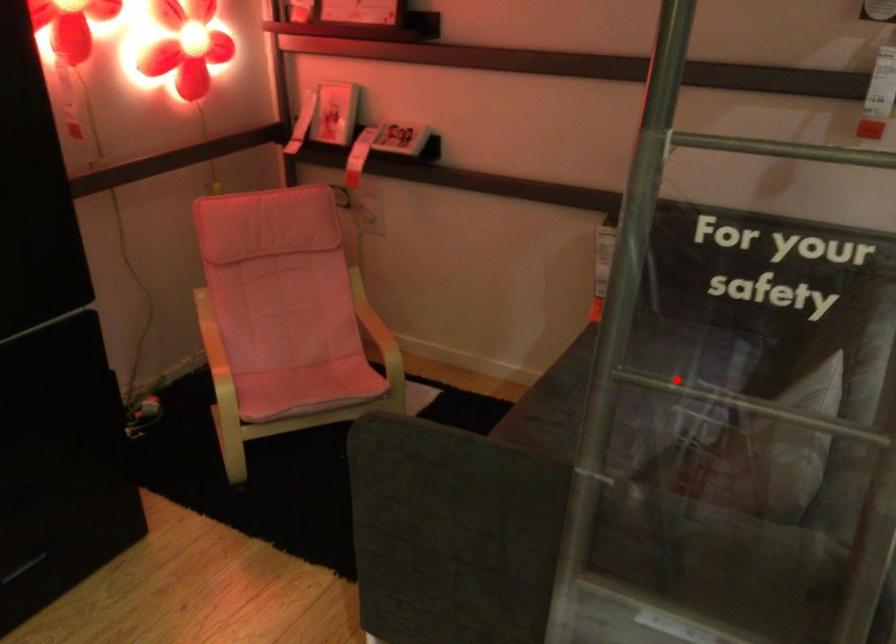
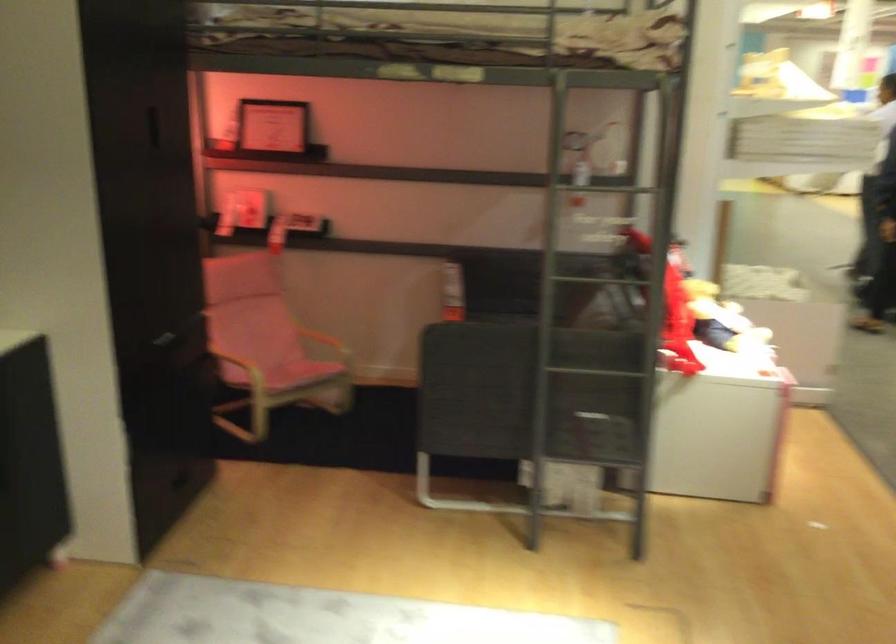
The point at the highlighted location is marked in the first image. Where is the corresponding point in the second image?

(591, 278)